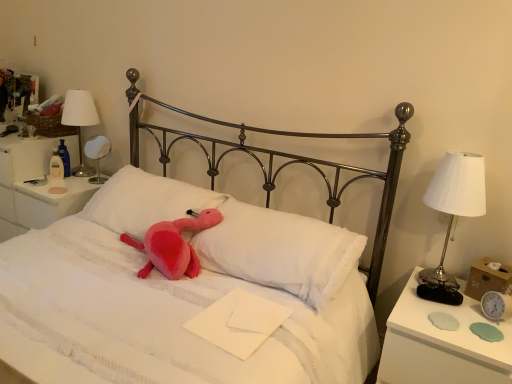
Question: From the image's perspective, is matte silver mirror at left, the first bedside lamp in the back-to-front sequence, located above or below white soft pillow at center, the 2th pillow from the left?

Choices:
 (A) below
 (B) above

Answer: (B)

Question: Based on their positions, is matte silver mirror at left, which is the 2th bedside lamp from right to left, located to the left or right of white soft pillow at center, acting as the first pillow starting from the right?

Choices:
 (A) right
 (B) left

Answer: (B)

Question: Based on their relative distances, which object is nearer to the matte silver mirror at left, the second bedside lamp when ordered from left to right?

Choices:
 (A) pink plush toy at center
 (B) white plastic nightstand at left, the second nightstand positioned from the front
 (C) pink plush toy at center
 (D) white soft pillow at center, the 2th pillow from the left
 (E) silver metallic clock at right

Answer: (B)

Question: Considering the real-world distances, which object is farthest from the fluffy pink pillow at center, which is the 1th pillow from left to right?

Choices:
 (A) pink plush toy at center
 (B) white soft pillow at center, the 2th pillow from the left
 (C) white fabric lampshade at upper left, the 2th bedside lamp in the back-to-front sequence
 (D) silver metallic clock at right
 (E) white plastic nightstand at left, the first nightstand from the back

Answer: (D)